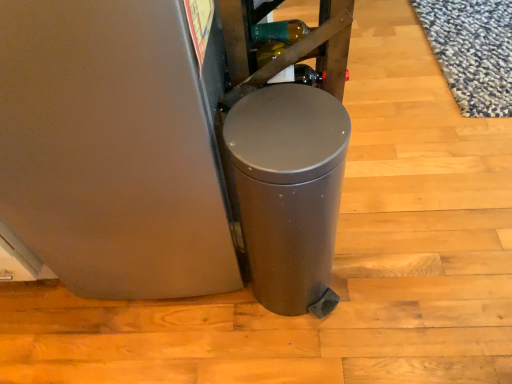
Identify the location of blank area to the left of satin metallic trash can at center. Image resolution: width=512 pixels, height=384 pixels. (211, 324).